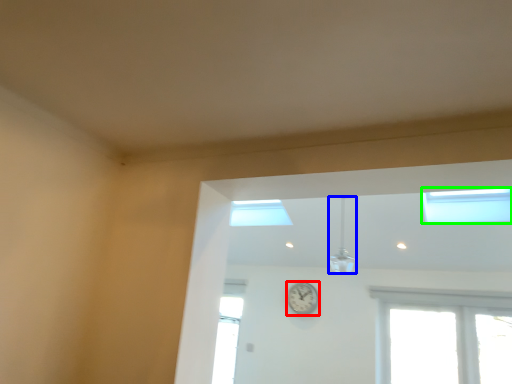
Question: Considering the real-world distances, which object is closest to clock (highlighted by a red box)? light fixture (highlighted by a blue box) or window (highlighted by a green box).

Choices:
 (A) light fixture
 (B) window

Answer: (A)